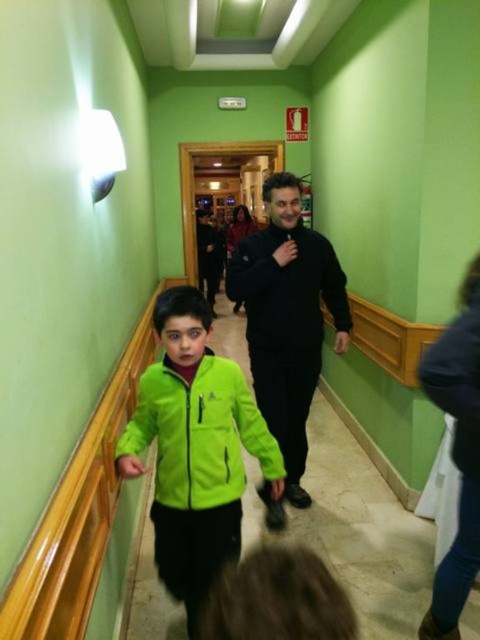
You are a delivery person carrying a box that is 3 feet wide. You need to walk through the hallway and pass between the green fleece jacket at lower left and the black matte sweatshirt at center. Is there enough space for you and your box to pass through without touching either?

The distance between the green fleece jacket at lower left and the black matte sweatshirt at center is 36.13 inches. Since 3 feet equals 36 inches, there is only 0.13 inches of extra space. This is insufficient for safely passing through with a box, as even a slight movement could cause contact. Therefore, it is not advisable to attempt passing through this narrow space.

You are planning to hang a coat rack in the hallway. The neon green jacket at center and the black matte jacket at center are both present in the scene. Which jacket would require a larger hook size based on their sizes?

The black matte jacket at center requires a larger hook since it is bigger than the neon green jacket at center.